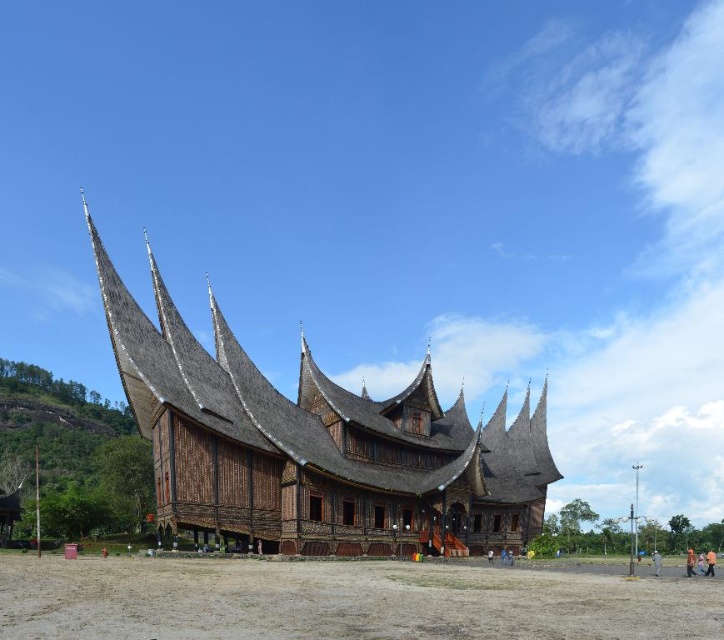
Between brown wooden temple at center and brown sandy dirt field at lower center, which one is positioned lower?

Positioned lower is brown sandy dirt field at lower center.

Does point (189, 369) come in front of point (75, 596)?

No, (189, 369) is behind (75, 596).

This screenshot has height=640, width=724. Identify the location of brown wooden temple at center. (x=316, y=445).